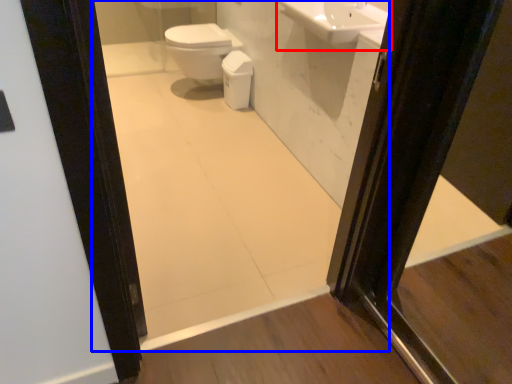
Question: Which point is further to the camera, sink (highlighted by a red box) or mirror (highlighted by a blue box)?

Choices:
 (A) sink
 (B) mirror

Answer: (A)